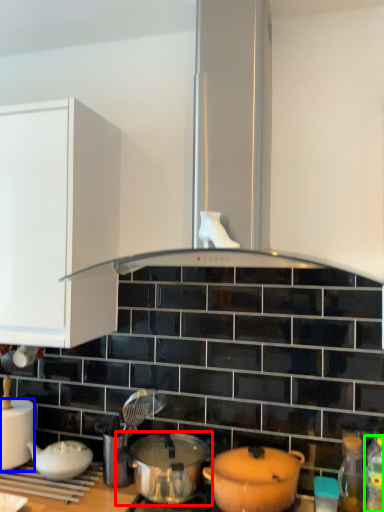
Question: Which is nearer to the pot/pan (highlighted by a red box)? kitchen appliance (highlighted by a blue box) or bottle (highlighted by a green box).

Choices:
 (A) kitchen appliance
 (B) bottle

Answer: (A)